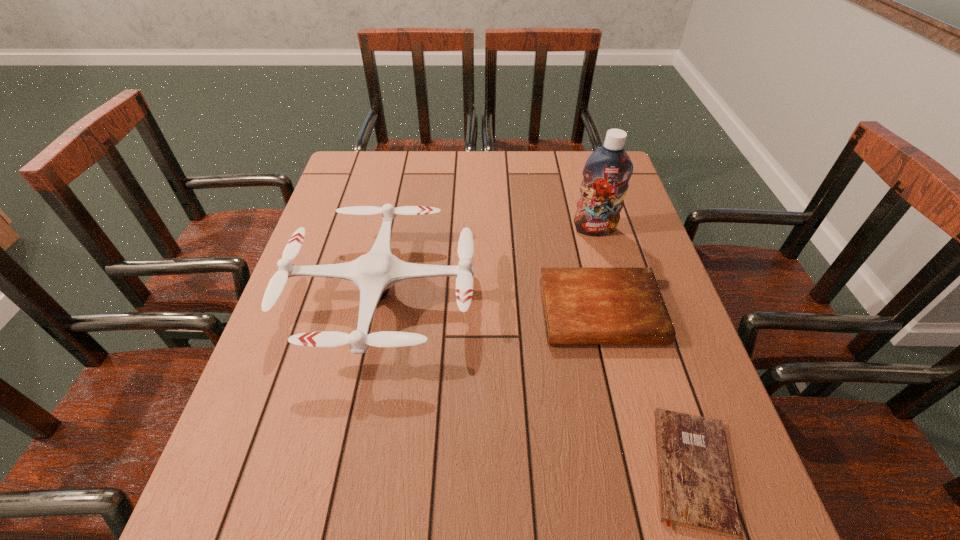
You are a GUI agent. You are given a task and a screenshot of the screen. Output one action in this format:
    pyautogui.click(x=<x>, y=<y>)
    Task: Click on the free location that satisfies the following two spatial constraints: 1. on the front label of the tallest object; 2. on the right side of the nearer Bible
    
    Given the screenshot: What is the action you would take?
    pyautogui.click(x=661, y=469)

The image size is (960, 540). I want to click on free region that satisfies the following two spatial constraints: 1. on the front label of the nearer Bible; 2. on the right side of the tallest object, so click(x=661, y=469).